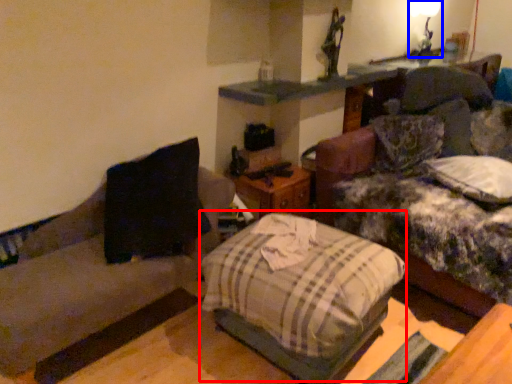
Question: Which point is further to the camera, bed (highlighted by a red box) or light fixture (highlighted by a blue box)?

Choices:
 (A) bed
 (B) light fixture

Answer: (B)